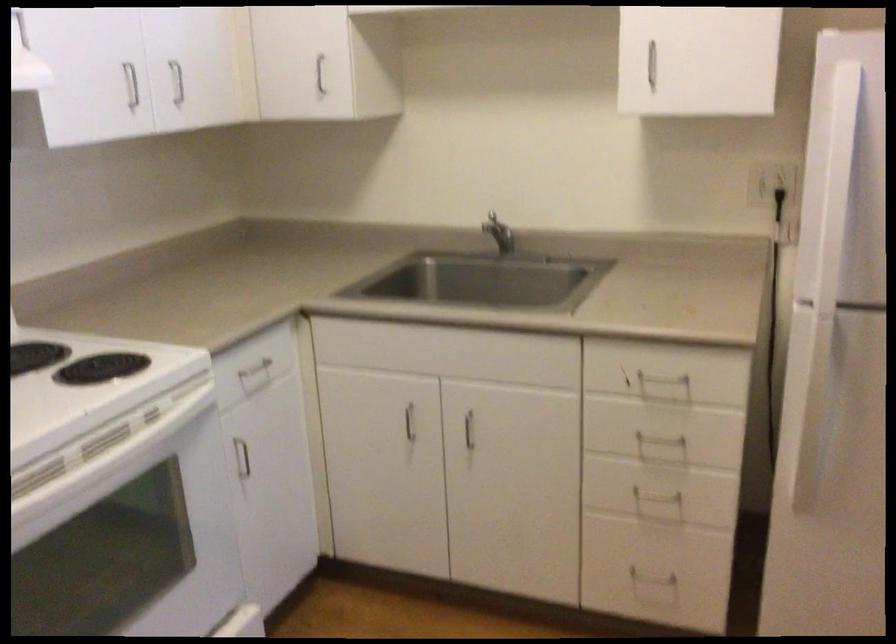
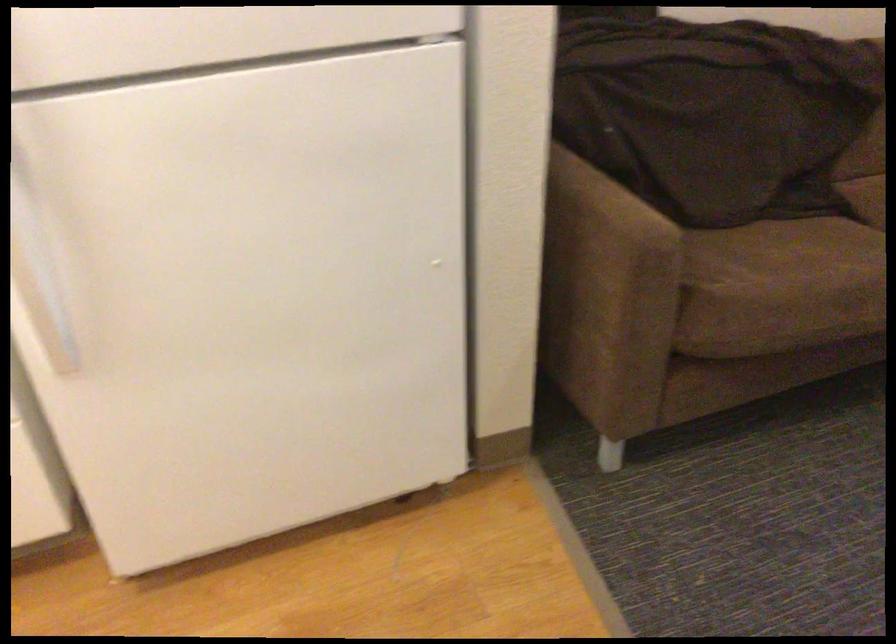
How did the camera likely rotate?

The camera rotated toward right-down.